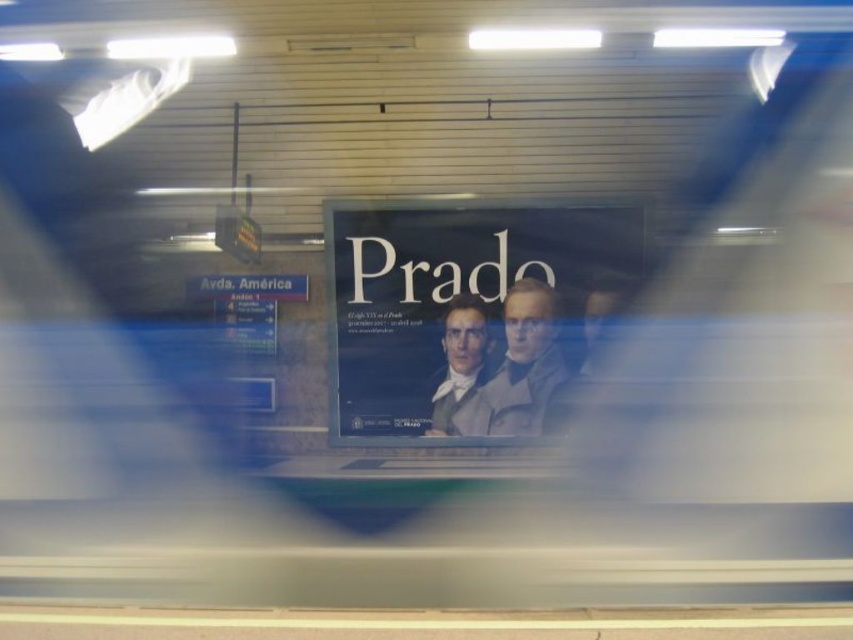
Is matte black poster at center closer to camera compared to smooth gray coat at center?

That is True.

Identify the location of matte black poster at center. The image size is (853, 640). (467, 310).

The image size is (853, 640). I want to click on matte black poster at center, so click(x=467, y=310).

Is matte black poster at center smaller than smooth gray suit at center?

No.

Is matte black poster at center thinner than smooth gray suit at center?

No.

Is point (360, 323) farther from camera compared to point (473, 392)?

Yes, point (360, 323) is behind point (473, 392).

The width and height of the screenshot is (853, 640). I want to click on matte black poster at center, so [x=467, y=310].

Which is above, smooth gray coat at center or smooth gray suit at center?

smooth gray coat at center is higher up.

Can you confirm if smooth gray coat at center is positioned to the right of smooth gray suit at center?

Yes, smooth gray coat at center is to the right of smooth gray suit at center.

The height and width of the screenshot is (640, 853). Identify the location of smooth gray coat at center. (518, 369).